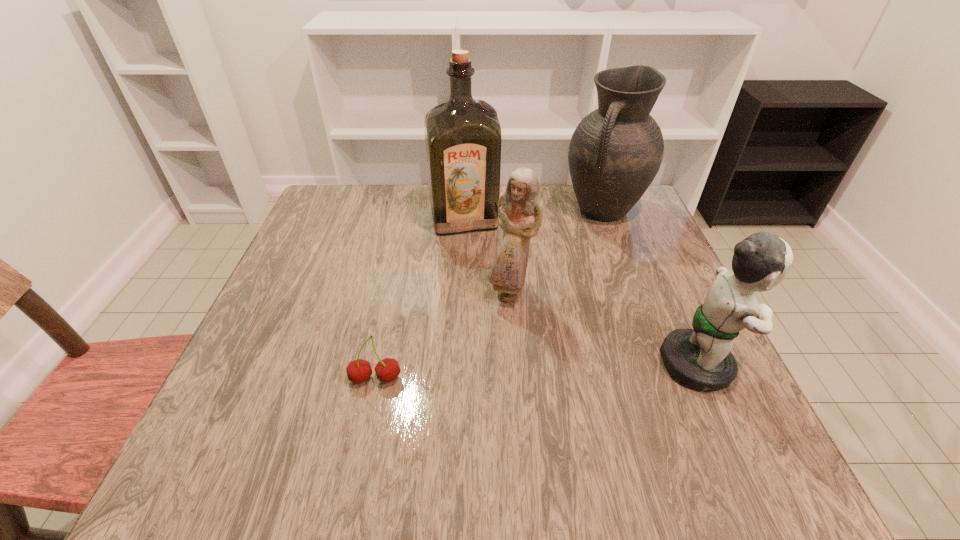
Identify the location of figurine located in the near edge section of the desktop. Image resolution: width=960 pixels, height=540 pixels. (701, 358).

At what (x,y) coordinates should I click in order to perform the action: click on figurine located in the right edge section of the desktop. Please return your answer as a coordinate pair (x, y). This screenshot has width=960, height=540. Looking at the image, I should click on (701, 358).

Image resolution: width=960 pixels, height=540 pixels. What are the coordinates of `pitcher that is at the right edge` in the screenshot? It's located at (615, 152).

At what (x,y) coordinates should I click in order to perform the action: click on object present at the far right corner. Please return your answer as a coordinate pair (x, y). Looking at the image, I should click on (615, 152).

Identify the location of object that is at the near right corner. (701, 358).

Locate an element on the screen. The image size is (960, 540). free space at the far edge of the desktop is located at coordinates (564, 209).

Locate an element on the screen. This screenshot has height=540, width=960. blank space at the near edge of the desktop is located at coordinates (440, 390).

Where is `free location at the left edge`? The image size is (960, 540). free location at the left edge is located at coordinates (261, 348).

Find the location of a particular element. This screenshot has height=540, width=960. vacant space at the right edge of the desktop is located at coordinates (678, 278).

Locate an element on the screen. The width and height of the screenshot is (960, 540). blank space at the far left corner is located at coordinates (355, 218).